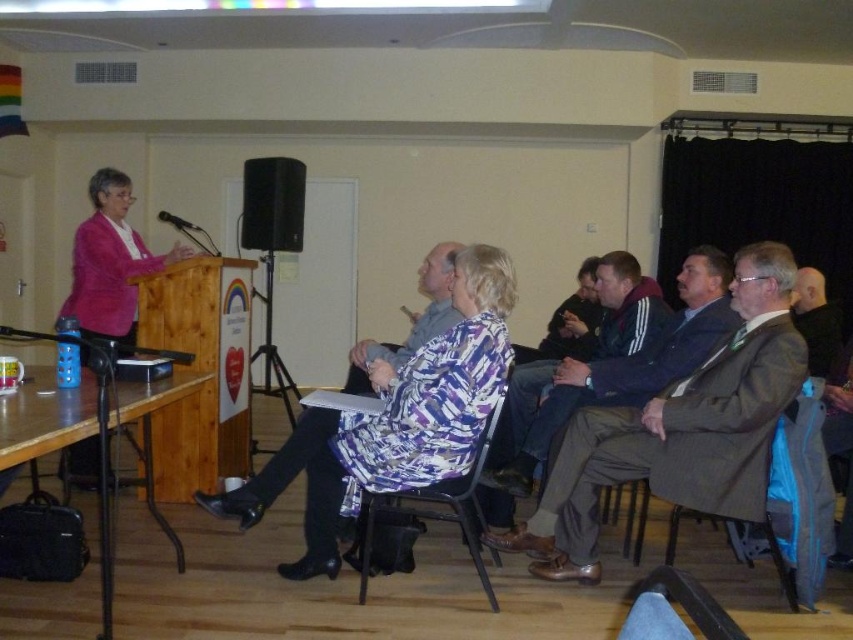
You are an event organizer who needs to ensure that all speakers can be seen by the audience. You notice two speakers wearing a brown woolen suit at center and a dark blue jacket at center. Which speaker should you position closer to the podium to ensure visibility?

The brown woolen suit at center is much taller than the dark blue jacket at center, so positioning the speaker in the brown woolen suit at center closer to the podium will ensure that both speakers can be seen by the audience.

You are a guest at this event and need to place your coat on a surface. Which object, the wooden table at lower left or the brown fabric chair at lower right, is a better option for placing your coat?

The wooden table at lower left is taller than the brown fabric chair at lower right, so placing your coat on the wooden table at lower left would be more convenient as it offers a higher surface.

You are an event organizer arranging seating for attendees. You notice two people wearing the brown woolen suit at center and dark blue jacket at center. Which one is positioned to the right side of the other?

The brown woolen suit at center is positioned to the right of the dark blue jacket at center.